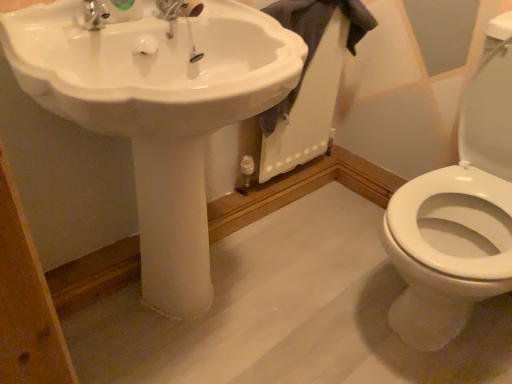
Locate an element on the screen. This screenshot has width=512, height=384. free point below white glossy sink at center (from a real-world perspective) is located at coordinates (192, 311).